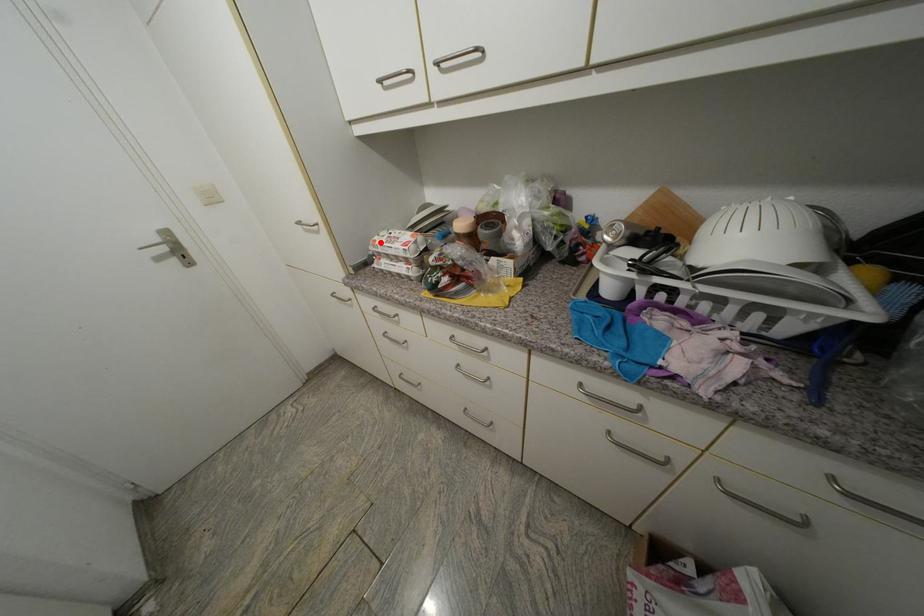
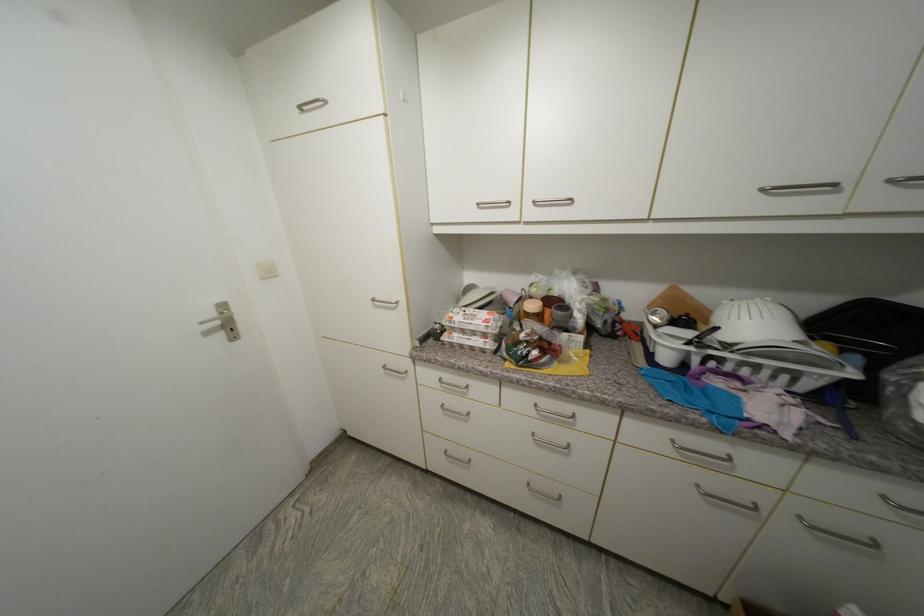
Where in the second image is the point corresponding to the highlighted location from the first image?

(457, 318)